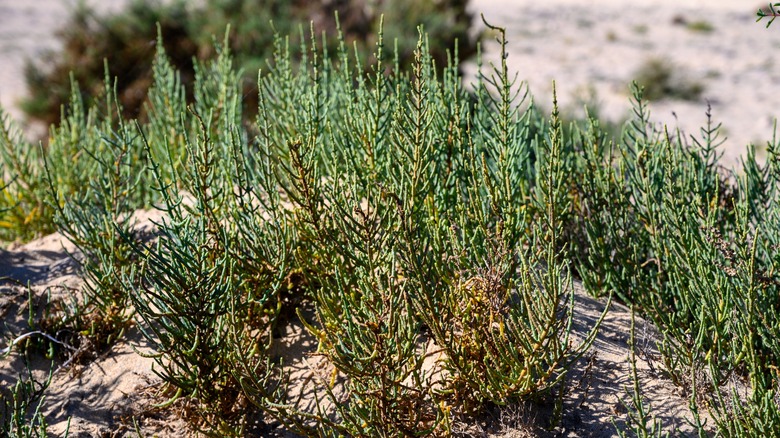
Image resolution: width=780 pixels, height=438 pixels. In order to click on plant in this screenshot , I will do `click(441, 234)`.